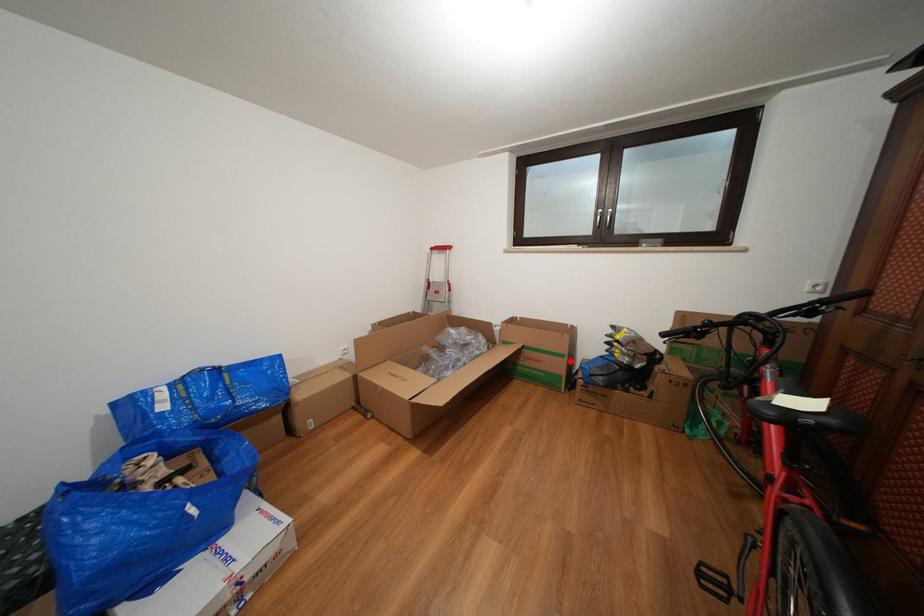
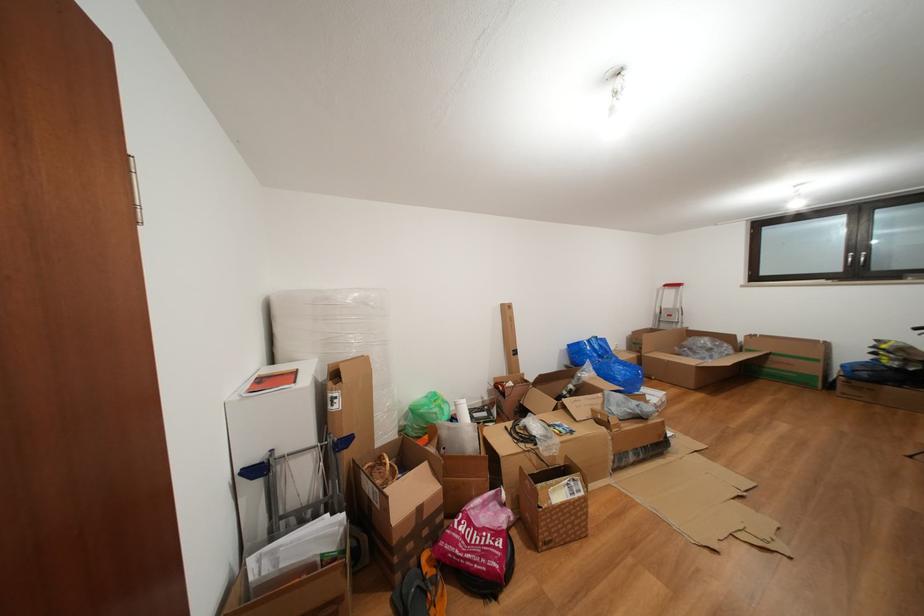
Locate, in the second image, the point that corresponds to the highlighted location in the first image.

(824, 366)